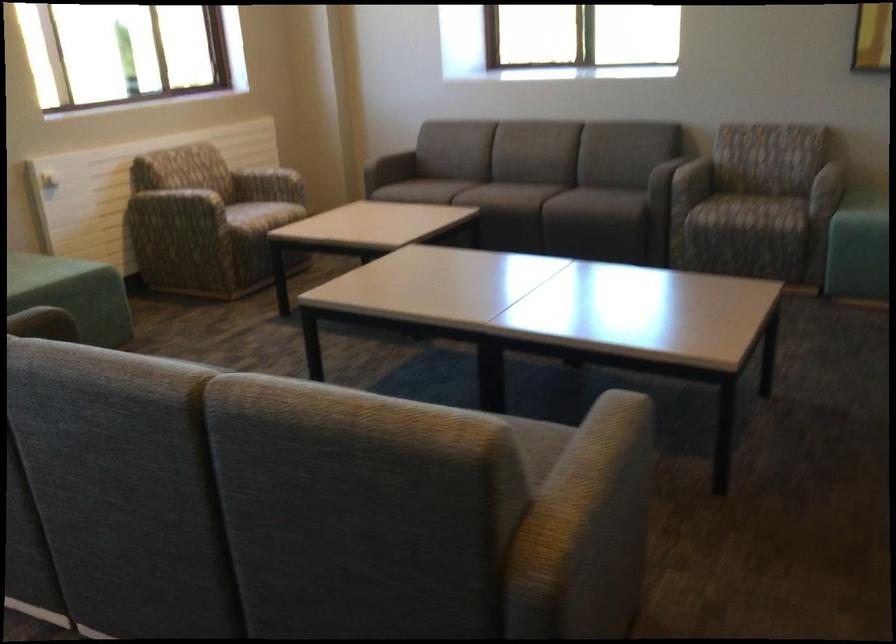
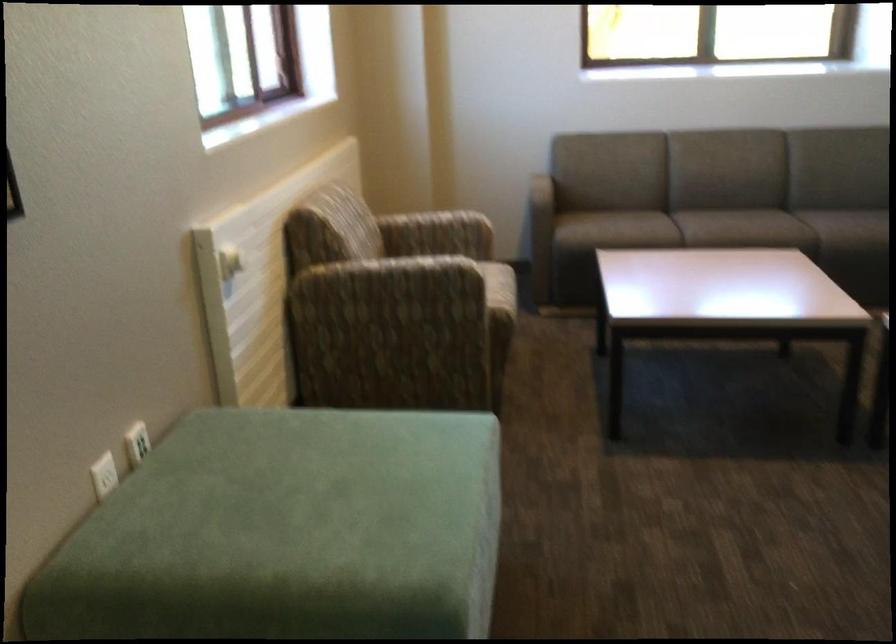
Locate, in the second image, the point that corresponds to point (266, 198) in the first image.

(458, 254)